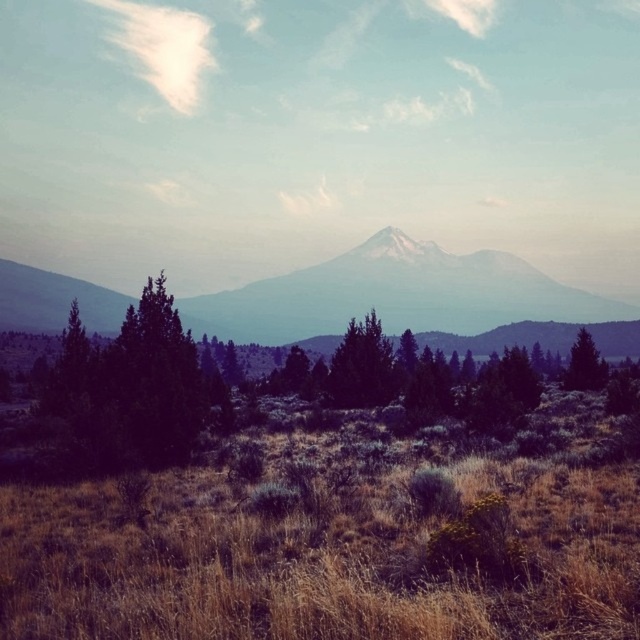
You are a hiker trying to cross the area between the brown dry grass at center and the dark green textured tree at center. Which direction should you head to move away from the tree?

To move away from the dark green textured tree at center, you should head towards the brown dry grass at center since they are positioned at the same central area, but the grass might be wider, providing more space away from the tree.